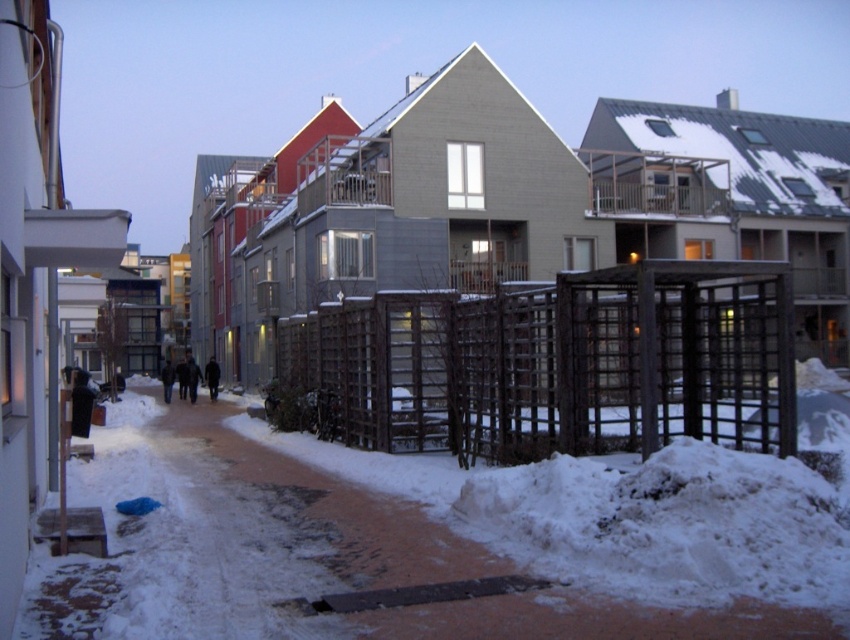
You are a delivery robot with a width of 0.8 meters. You need to navigate through the path between the brown concrete pavement at center and the brown wooden fence at center. Can you fit through the path without touching either side?

The brown concrete pavement at center is wider than the brown wooden fence at center, but the exact width isn t specified. Since the robot is 0.8 meters wide, it s possible that the path between them is wide enough. However, without specific measurements, we can t be certain. The safest assumption is that the path is wider than the robot, so it should fit.

You are a delivery person trying to reach a doorstep located behind the brown wooden fence at center. Can you walk directly to the doorstep from the brown concrete pavement at center without going around the fence?

The brown concrete pavement at center is in front of the brown wooden fence at center, so you would need to go around the fence to reach the doorstep behind it. You cannot walk directly through the fence.

You are a delivery person trying to navigate through the snowy path. You see the brown concrete pavement at center and the brown wooden fence at center. Which object is closer to the ground?

The brown concrete pavement at center is positioned under the brown wooden fence at center, so the brown concrete pavement at center is closer to the ground.